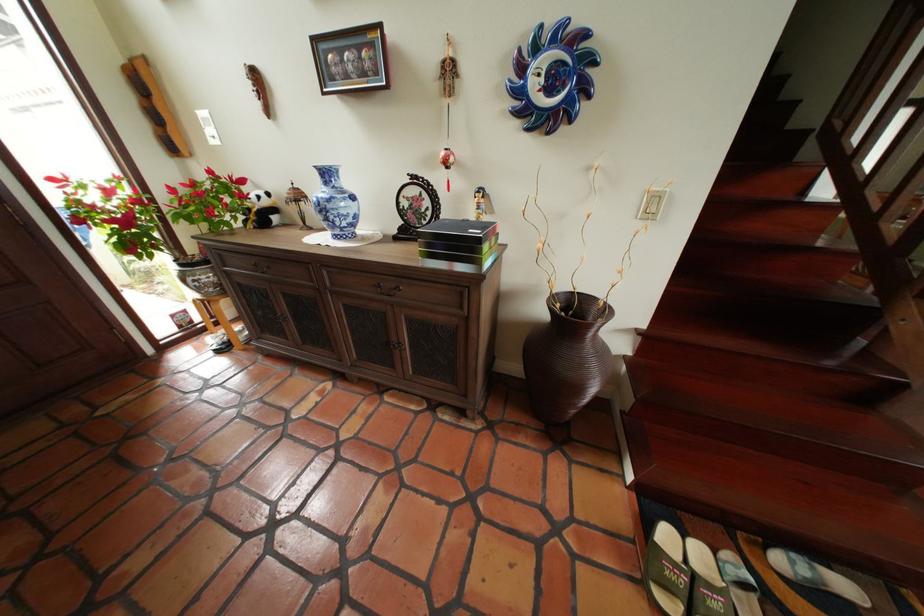
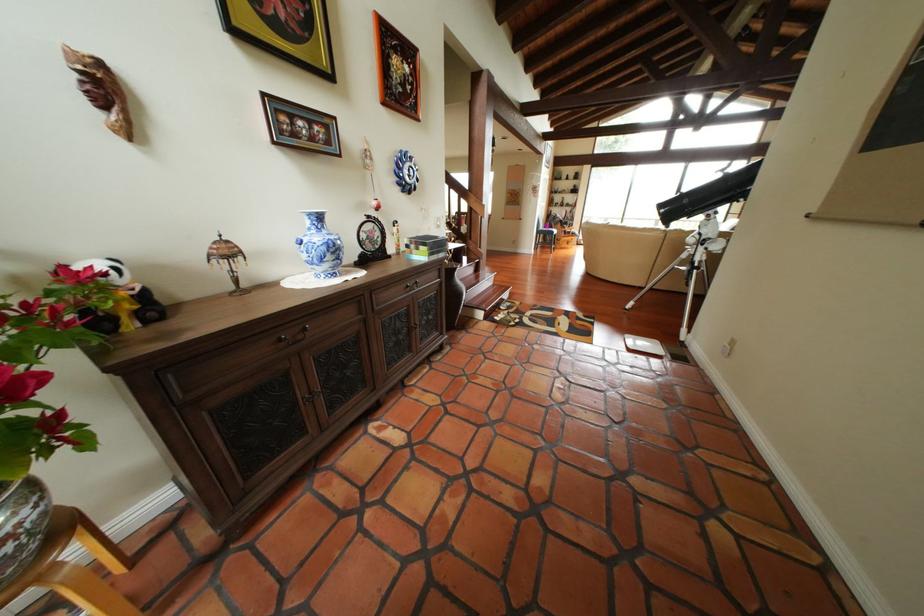
Find the pixel in the second image that matches [310,201] in the first image.

(241, 257)